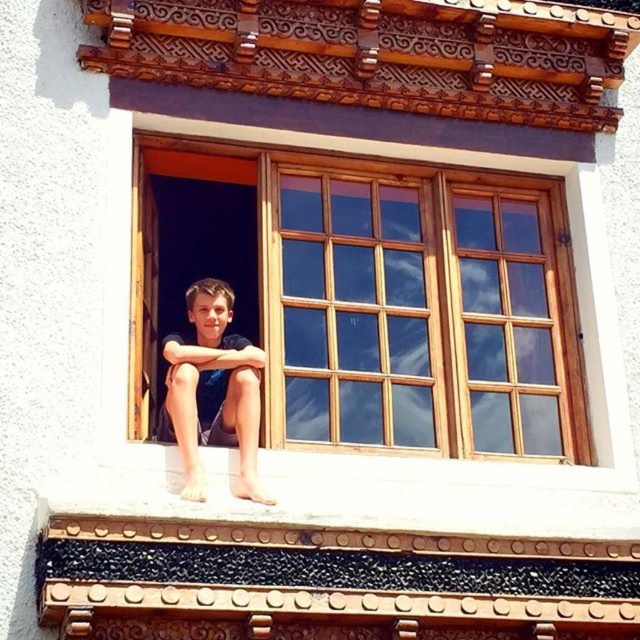
You are standing in the room and want to place a small potted plant on the wooden window at center. Considering the position of the dark blue fabric shorts at center, where should you place the plant to avoid blocking the view of the shorts?

You should place the small potted plant to the right side of the wooden window at center since the wooden window at center is to the right of the dark blue fabric shorts at center, so placing the plant to the right of the window won

You are a painter standing 5 meters away from the wooden window at center and dark blue fabric shorts at center. Which object is closer to you?

The dark blue fabric shorts at center is closer to you since it is only 4.84 meters away from the wooden window at center, making the distance between you and the shorts 4.84 meters and the window slightly further.

You are a tailor measuring fabric for a new pair of shorts. You have a fabric piece that is the same size as the wooden window at center. Can you use this fabric to make the dark blue fabric shorts at center without any adjustments?

The wooden window at center is bigger than dark blue fabric shorts at center, so yes, the fabric piece can be used to make the dark blue fabric shorts at center without any adjustments since it is larger than the required size.